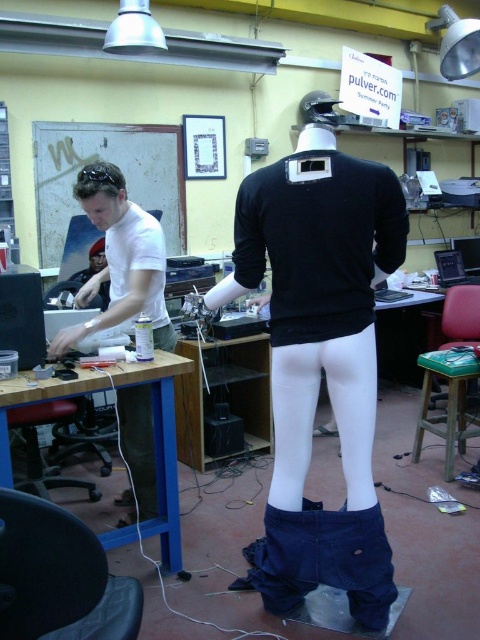
You are a tailor working in this studio and need to adjust the length of the black matte shirt at center. If your arm can reach up to 1.8 meters, can you comfortably reach the hem of the shirt without moving the mannequin?

The black matte shirt at center is 1.74 meters away from the viewer. Since your arm can reach up to 1.8 meters, you can comfortably reach the hem of the black matte shirt at center without needing to move the mannequin.

You are an assistant organizing the workshop. You need to place a box on top of the taller item between the black plastic stool at lower left and the matte black jacket at upper left. Which object should you choose?

The black plastic stool at lower left has a greater height compared to the matte black jacket at upper left, so you should place the box on top of the black plastic stool at lower left.